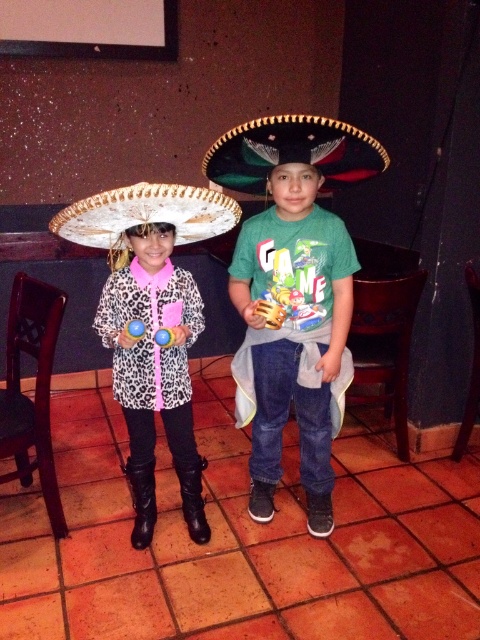
Question: Considering the relative positions of leopard print coat at center and white felt sombrero at left in the image provided, where is leopard print coat at center located with respect to white felt sombrero at left?

Choices:
 (A) right
 (B) left

Answer: (A)

Question: Among these points, which one is nearest to the camera?

Choices:
 (A) coord(267,218)
 (B) coord(322,150)

Answer: (B)

Question: Does green matte shirt at center have a lesser width compared to white felt sombrero at left?

Choices:
 (A) no
 (B) yes

Answer: (B)

Question: Is green felt sombrero at center below white felt sombrero at left?

Choices:
 (A) no
 (B) yes

Answer: (A)

Question: Which point is farther to the camera?

Choices:
 (A) white felt sombrero at left
 (B) green felt sombrero at center
 (C) green matte shirt at center
 (D) leopard print jacket at center

Answer: (A)

Question: Which object appears farthest from the camera in this image?

Choices:
 (A) leopard print coat at center
 (B) leopard print jacket at center
 (C) green felt sombrero at center
 (D) green matte shirt at center

Answer: (A)